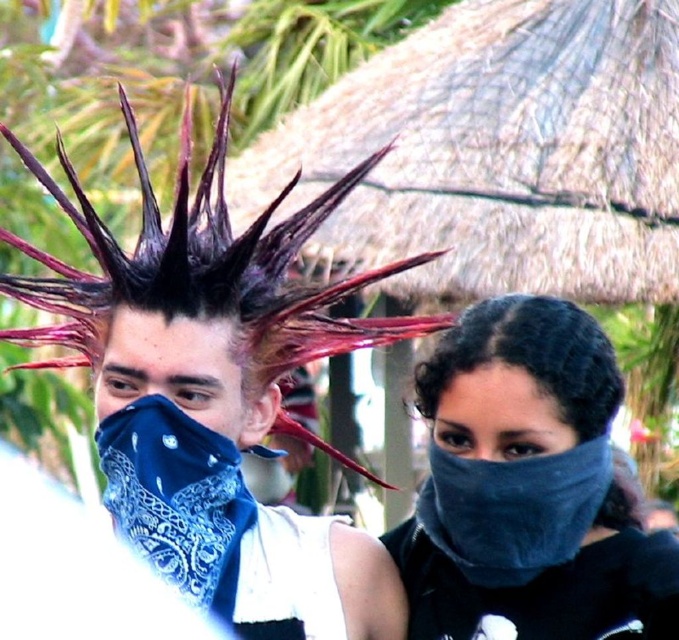
Question: Which object is farther from the camera taking this photo?

Choices:
 (A) blue bandana at center
 (B) smooth black fabric at center
 (C) dark curly hair at center
 (D) shiny dark hair at center

Answer: (A)

Question: Which object is closer to the camera taking this photo?

Choices:
 (A) blue bandana at center
 (B) smooth black fabric at center

Answer: (B)

Question: Is dark curly hair at center bigger than blue bandana at center?

Choices:
 (A) yes
 (B) no

Answer: (A)

Question: From the image, what is the correct spatial relationship of blue bandana at center in relation to smooth black fabric at center?

Choices:
 (A) below
 (B) above

Answer: (B)

Question: Estimate the real-world distances between objects in this image. Which object is closer to the blue bandana at center?

Choices:
 (A) velvet dark blue scarf at center
 (B) dark curly hair at center
 (C) shiny dark hair at center

Answer: (C)

Question: Observing the image, what is the correct spatial positioning of dark curly hair at center in reference to blue bandana at center?

Choices:
 (A) left
 (B) right

Answer: (B)